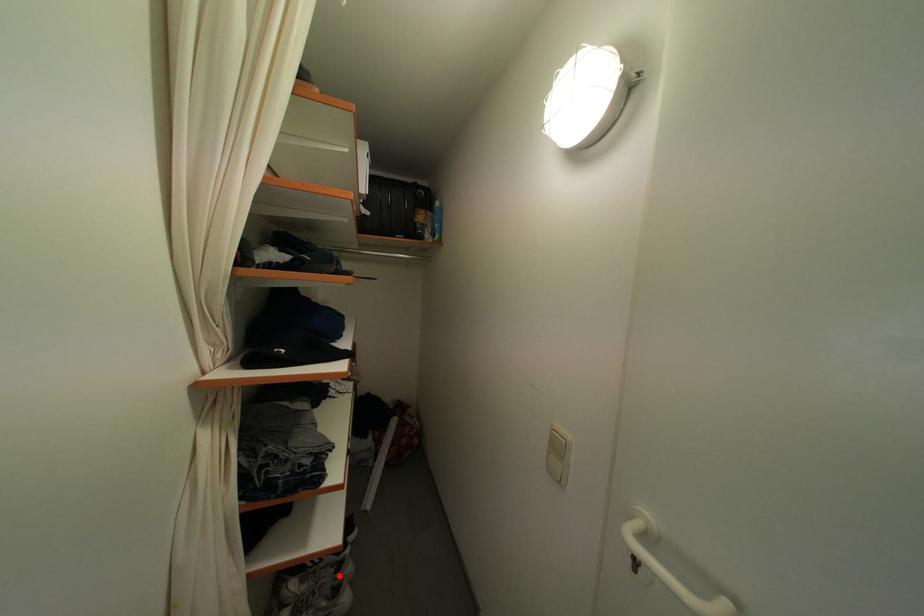
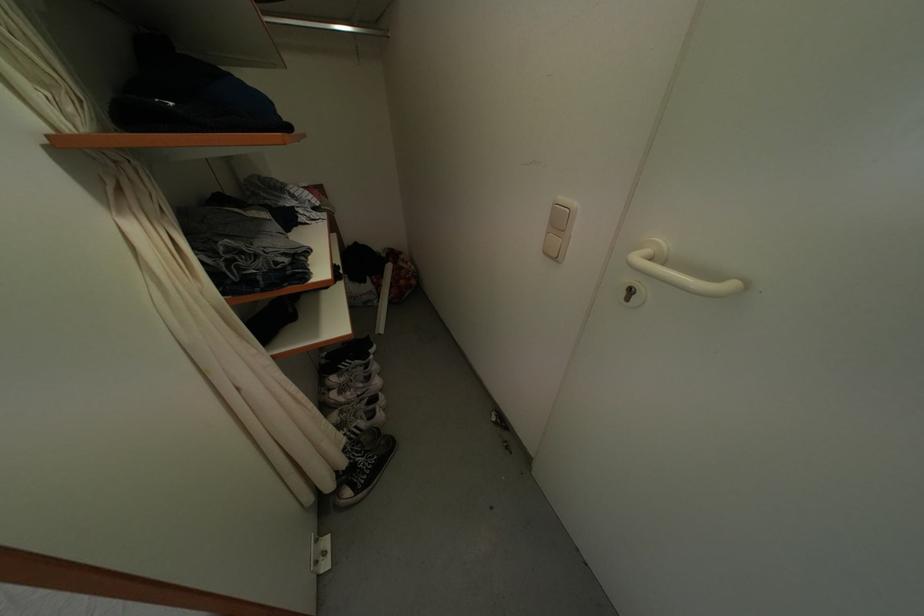
Question: I am providing you with two images of the same scene from different viewpoints. A red point is marked on the first image. At the location where the point appears in image 1, is it still visible in image 2?

Choices:
 (A) Yes
 (B) No

Answer: (A)